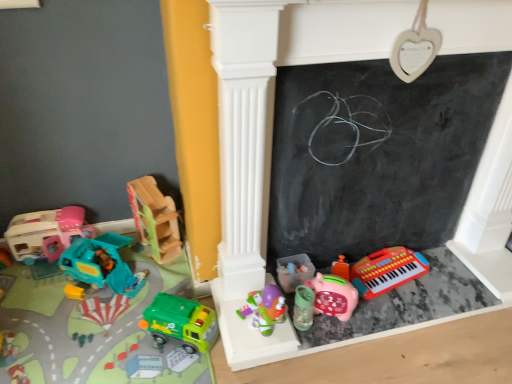
Where is `vacant space in front of rubberized plastic keyboard at lower right, which appears as the first toy when viewed from the right`? The width and height of the screenshot is (512, 384). vacant space in front of rubberized plastic keyboard at lower right, which appears as the first toy when viewed from the right is located at coordinates (404, 307).